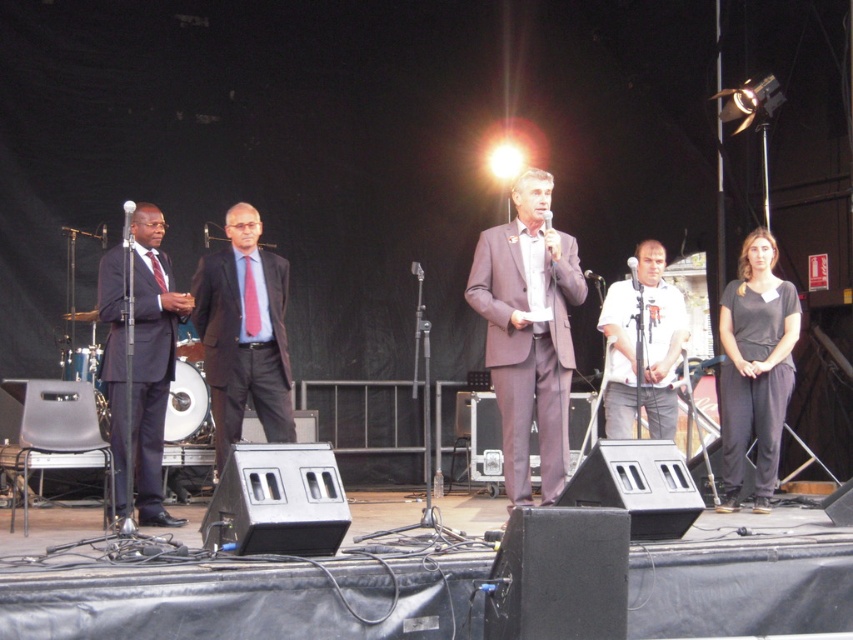
You are an event photographer positioned at the back of the stage. You need to capture a clear photo of both the matte black suit at center and the white cotton shirt at center. Which one will appear larger in your photo?

The matte black suit at center will appear larger in the photo because it is closer to the viewer than the white cotton shirt at center.

You are an event photographer trying to capture a clear shot of the metallic silver microphone at center and the black cotton pants at right. Based on their positions, which object is located to the right of the other?

The black cotton pants at right is positioned on the right side of metallic silver microphone at center, so the black cotton pants at right is to the right of the metallic silver microphone at center.

Looking at this image, you are an event organizer who needs to adjust the microphone stand height for the performers. Based on the image, which performer requires a taller microphone stand between the matte black suit at center and the white cotton shirt at center?

The matte black suit at center requires a taller microphone stand because they are much taller than the white cotton shirt at center.